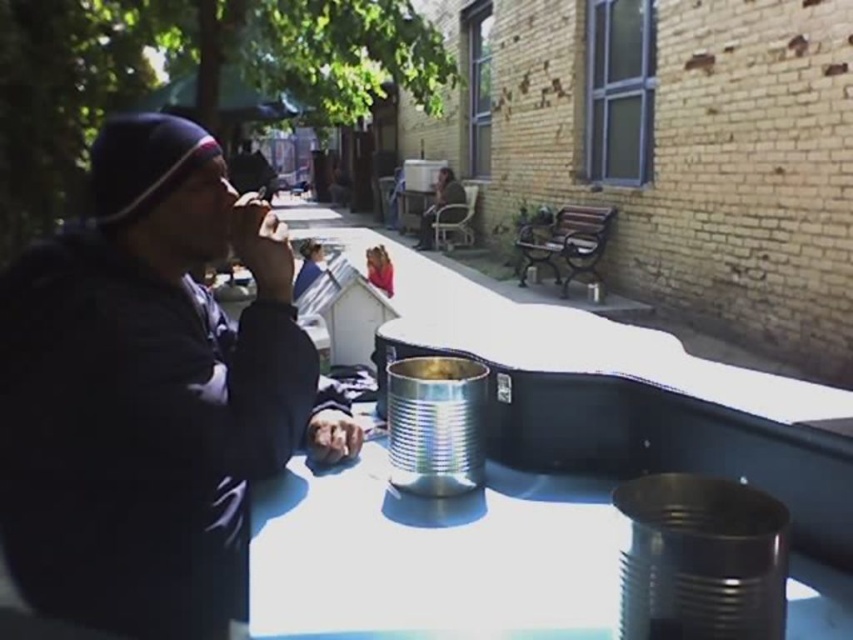
Question: Which point is farther to the camera?

Choices:
 (A) (537, 532)
 (B) (177, 189)
 (C) (427, 209)

Answer: (C)

Question: Which point is farther to the camera?

Choices:
 (A) pyautogui.click(x=607, y=568)
 (B) pyautogui.click(x=242, y=451)

Answer: (A)

Question: Can you confirm if metallic silver can at center is positioned above dark brown leather jacket at center?

Choices:
 (A) no
 (B) yes

Answer: (A)

Question: Can you confirm if matte black jacket at left is positioned above dark brown leather jacket at center?

Choices:
 (A) no
 (B) yes

Answer: (A)

Question: Which of the following is the farthest from the observer?

Choices:
 (A) metallic silver can at center
 (B) matte black jacket at left

Answer: (B)

Question: Can you confirm if metallic silver can at center is positioned above dark brown leather jacket at center?

Choices:
 (A) yes
 (B) no

Answer: (B)